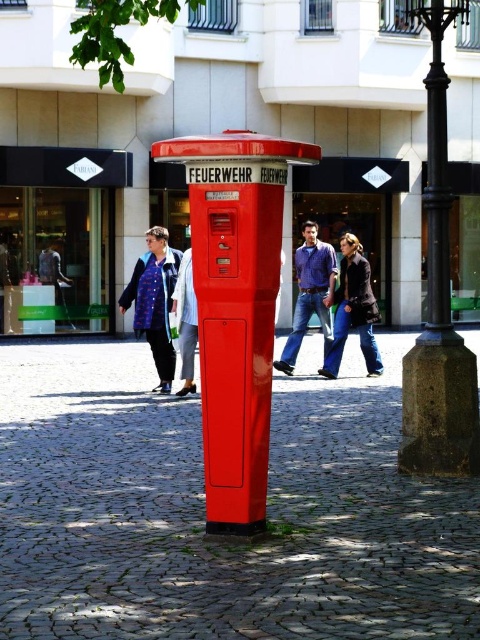
Question: Which of these objects is positioned closest to the blue plaid coat at center?

Choices:
 (A) denim jeans at center
 (B) matte red fire alarm at center
 (C) dark blue jeans at center

Answer: (C)

Question: Does smooth cobblestone pavement at center appear on the right side of dark blue jeans at center?

Choices:
 (A) no
 (B) yes

Answer: (A)

Question: Estimate the real-world distances between objects in this image. Which object is farther from the smooth cobblestone pavement at center?

Choices:
 (A) black metal pole at right
 (B) blue plaid coat at center
 (C) dark blue jeans at center

Answer: (A)

Question: Is blue plaid coat at center closer to the viewer compared to dark blue jeans at center?

Choices:
 (A) yes
 (B) no

Answer: (A)

Question: Among these objects, which one is farthest from the camera?

Choices:
 (A) blue plaid coat at center
 (B) matte red fire alarm at center

Answer: (A)

Question: Observing the image, what is the correct spatial positioning of dark blue jeans at center in reference to denim jeans at center?

Choices:
 (A) right
 (B) left

Answer: (A)